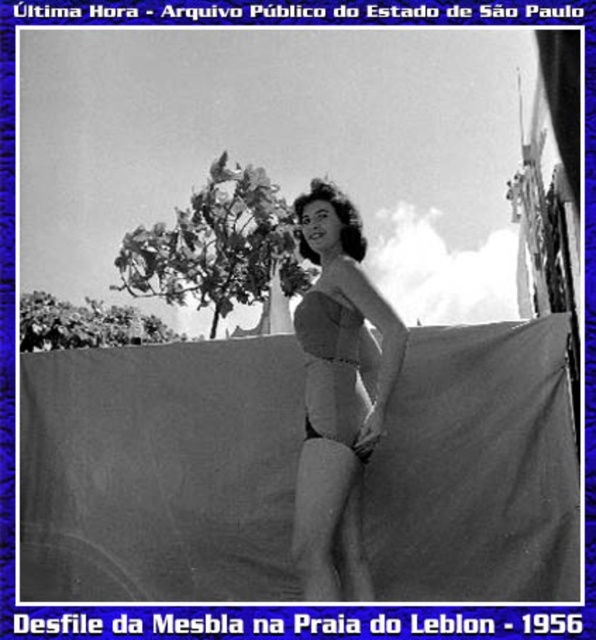
Is gray fabric at center bigger than matte fabric bikini top at center?

Yes, gray fabric at center is bigger than matte fabric bikini top at center.

Does point (70, 541) come behind point (316, 326)?

Yes, point (70, 541) is behind point (316, 326).

Is point (119, 554) more distant than point (311, 317)?

That is True.

The width and height of the screenshot is (596, 640). I want to click on gray fabric at center, so click(x=159, y=472).

Consider the image. Between smooth fabric swimsuit at center and matte fabric bikini top at center, which one is positioned lower?

smooth fabric swimsuit at center

This screenshot has height=640, width=596. In order to click on smooth fabric swimsuit at center in this screenshot , I will do click(339, 392).

Locate an element on the screen. The width and height of the screenshot is (596, 640). smooth fabric swimsuit at center is located at coordinates (339, 392).

Between point (386, 461) and point (311, 518), which one is positioned behind?

The point (386, 461) is more distant.

Is the position of gray fabric at center more distant than that of smooth fabric swimsuit at center?

Yes, gray fabric at center is behind smooth fabric swimsuit at center.

Image resolution: width=596 pixels, height=640 pixels. Find the location of `gray fabric at center`. gray fabric at center is located at coordinates (159, 472).

The height and width of the screenshot is (640, 596). I want to click on gray fabric at center, so click(159, 472).